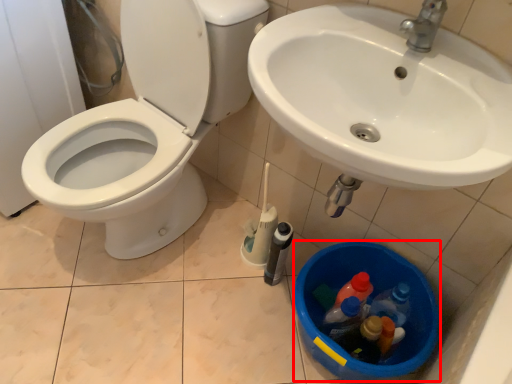
Question: From the image, what is the correct spatial relationship of potty (annotated by the red box) in relation to toilet?

Choices:
 (A) left
 (B) right

Answer: (B)